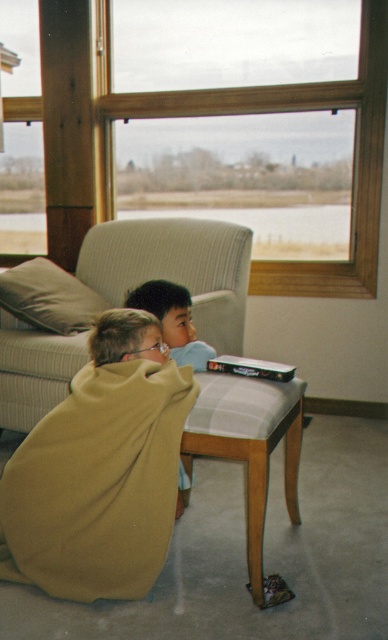
You are standing in the room and want to reach the DVD case on the table. The soft yellow blanket at lower left is in your way. Can you step over it? Please explain using its position coordinates.

The soft yellow blanket at lower left is located at coordinates (98, 483). Since the coordinates are relative to the image, stepping over it would depend on its actual size in the room. However, without knowing the scale, we can assume the blanket is large enough to obstruct your path, making it necessary to step over or move it.

You are standing in the room and want to place a small toy between the two points labeled point (367, 268) and point (174, 296). Which point is closer to you so you can place the toy there first?

Point (174, 296) is closer to you than point (367, 268), so you can place the toy near point (174, 296) first.

You are a window installer who needs to replace the wooden frame at upper center. The current frame is at position coordinates of point 0.175, 0.709. You have a new frame that is slightly larger. Will the new frame fit in the same position without moving the existing structure?

The wooden frame at upper center is currently positioned at point (275, 112). Since the new frame is slightly larger, it may not fit in the same position without adjustments to the existing structure to accommodate its size.